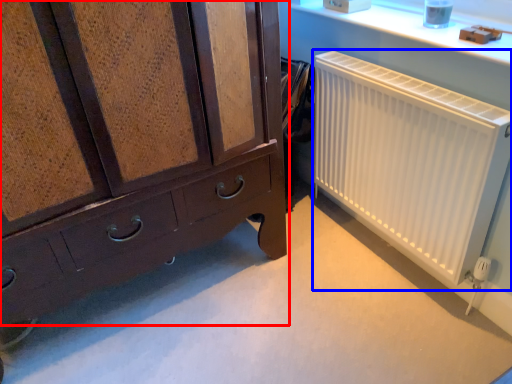
Question: Which point is closer to the camera, chest of drawers (highlighted by a red box) or radiator (highlighted by a blue box)?

Choices:
 (A) chest of drawers
 (B) radiator

Answer: (A)